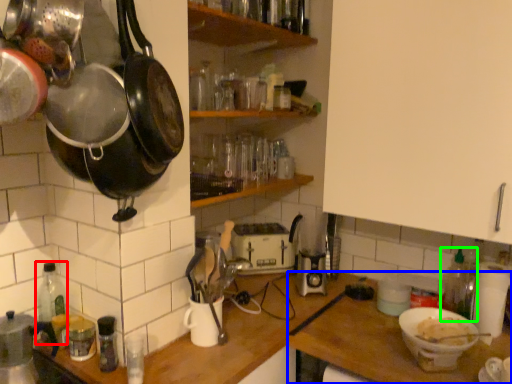
Question: Based on their relative distances, which object is nearer to bottle (highlighted by a red box)? Choose from table (highlighted by a blue box) and bottle (highlighted by a green box).

Choices:
 (A) table
 (B) bottle

Answer: (A)